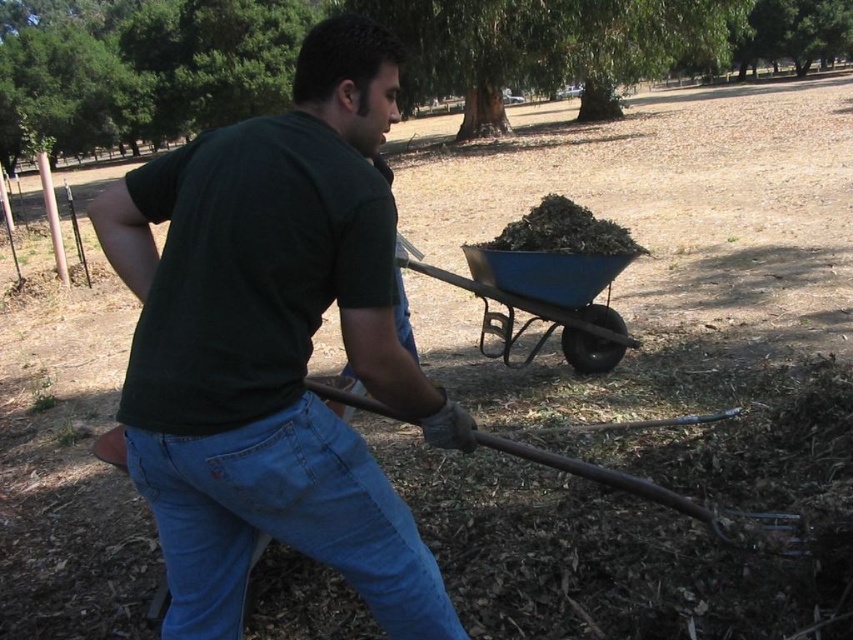
Question: Which object appears farthest from the camera in this image?

Choices:
 (A) rusty metal shovel at lower center
 (B) dark green t-shirt at center
 (C) denim at left
 (D) blue metal wheelbarrow at center

Answer: (D)

Question: Which object is the farthest from the dark green t-shirt at center?

Choices:
 (A) blue metal wheelbarrow at center
 (B) denim at left

Answer: (A)

Question: Can you confirm if dark green t-shirt at center is positioned to the left of blue metal wheelbarrow at center?

Choices:
 (A) yes
 (B) no

Answer: (A)

Question: Which point is farther from the camera taking this photo?

Choices:
 (A) (155, 56)
 (B) (297, 496)
 (C) (570, 358)
 (D) (720, 536)

Answer: (A)

Question: Does dark green t-shirt at center appear on the right side of rusty metal shovel at lower center?

Choices:
 (A) yes
 (B) no

Answer: (B)

Question: Does green leafy tree at upper left come in front of blue metal wheelbarrow at center?

Choices:
 (A) yes
 (B) no

Answer: (B)